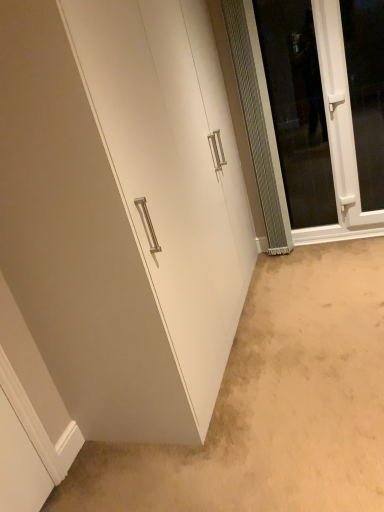
Question: Is white plastic window at upper right spatially inside clear glass screen door at right, or outside of it?

Choices:
 (A) inside
 (B) outside

Answer: (B)

Question: Looking at the image, does white plastic window at upper right seem bigger or smaller compared to clear glass screen door at right?

Choices:
 (A) small
 (B) big

Answer: (B)

Question: Estimate the real-world distances between objects in this image. Which object is farther from the white matte cabinet at center?

Choices:
 (A) clear glass screen door at right
 (B) white matte cabinet at lower left
 (C) white plastic window at upper right

Answer: (C)

Question: Based on their relative distances, which object is nearer to the white matte cabinet at center?

Choices:
 (A) white plastic window at upper right
 (B) white matte cabinet at lower left
 (C) clear glass screen door at right

Answer: (B)